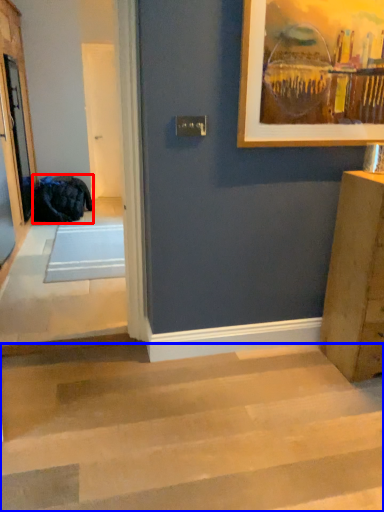
Question: Among these objects, which one is farthest to the camera, laundry (highlighted by a red box) or stairwell (highlighted by a blue box)?

Choices:
 (A) laundry
 (B) stairwell

Answer: (A)